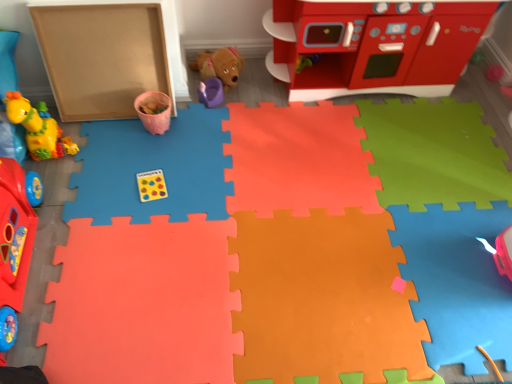
Question: From a real-world perspective, is matte cardboard box at left physically below pink matte cup at upper center, marked as the 5th toy in a right-to-left arrangement?

Choices:
 (A) yes
 (B) no

Answer: (B)

Question: Is matte cardboard box at left oriented away from pink matte cup at upper center, marked as the 5th toy in a right-to-left arrangement?

Choices:
 (A) yes
 (B) no

Answer: (A)

Question: Would you consider matte cardboard box at left to be distant from pink matte cup at upper center, acting as the third toy starting from the left?

Choices:
 (A) yes
 (B) no

Answer: (B)

Question: Is matte cardboard box at left wider than pink matte cup at upper center, marked as the 5th toy in a right-to-left arrangement?

Choices:
 (A) no
 (B) yes

Answer: (A)

Question: From a real-world perspective, is matte cardboard box at left over pink matte cup at upper center, marked as the 5th toy in a right-to-left arrangement?

Choices:
 (A) yes
 (B) no

Answer: (A)

Question: From a real-world perspective, is brown plush dog at center, positioned as the third toy in right-to-left order, above or below purple plastic cup at center, the fourth toy from the left?

Choices:
 (A) below
 (B) above

Answer: (B)

Question: Is brown plush dog at center, positioned as the third toy in right-to-left order, taller or shorter than purple plastic cup at center, the 4th toy in the right-to-left sequence?

Choices:
 (A) short
 (B) tall

Answer: (B)

Question: From the image's perspective, is brown plush dog at center, positioned as the third toy in right-to-left order, located above or below purple plastic cup at center, the fourth toy from the left?

Choices:
 (A) below
 (B) above

Answer: (B)

Question: In terms of size, does brown plush dog at center, placed as the fifth toy when sorted from left to right, appear bigger or smaller than purple plastic cup at center, the 4th toy in the right-to-left sequence?

Choices:
 (A) small
 (B) big

Answer: (B)

Question: In the image, is smooth plastic play kitchen at upper right, which is the 7th toy from left to right, positioned in front of or behind brown plush dog at center, placed as the fifth toy when sorted from left to right?

Choices:
 (A) behind
 (B) front

Answer: (B)

Question: From the image's perspective, is smooth plastic play kitchen at upper right, which is the 7th toy from left to right, above or below brown plush dog at center, placed as the fifth toy when sorted from left to right?

Choices:
 (A) above
 (B) below

Answer: (A)

Question: From a real-world perspective, is smooth plastic play kitchen at upper right, acting as the 1th toy starting from the right, above or below brown plush dog at center, positioned as the third toy in right-to-left order?

Choices:
 (A) below
 (B) above

Answer: (B)

Question: Considering the positions of smooth plastic play kitchen at upper right, acting as the 1th toy starting from the right, and brown plush dog at center, positioned as the third toy in right-to-left order, in the image, is smooth plastic play kitchen at upper right, acting as the 1th toy starting from the right, taller or shorter than brown plush dog at center, positioned as the third toy in right-to-left order,?

Choices:
 (A) tall
 (B) short

Answer: (A)

Question: Is point (358, 19) positioned closer to the camera than point (314, 124)?

Choices:
 (A) farther
 (B) closer

Answer: (B)

Question: Considering the positions of smooth plastic play kitchen at upper right, acting as the 1th toy starting from the right, and rubber duck at left, which appears as the 2th toy when viewed from the right, in the image, is smooth plastic play kitchen at upper right, acting as the 1th toy starting from the right, bigger or smaller than rubber duck at left, which appears as the 2th toy when viewed from the right,?

Choices:
 (A) small
 (B) big

Answer: (B)